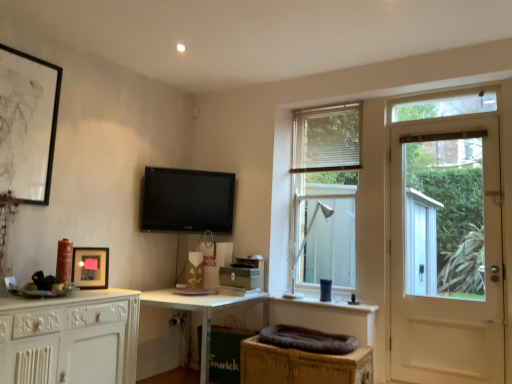
At what (x,y) coordinates should I click in order to perform the action: click on free spot above white wooden door at right (from a real-world perspective). Please return your answer as a coordinate pair (x, y). The width and height of the screenshot is (512, 384). Looking at the image, I should click on (440, 124).